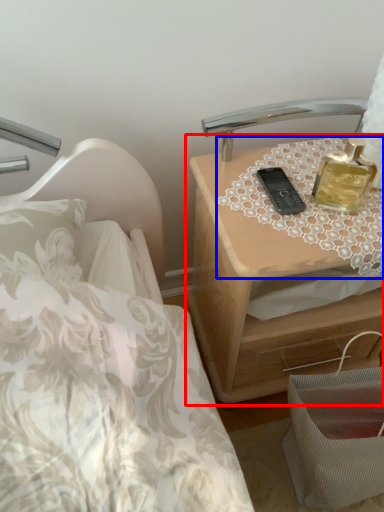
Question: Which object appears farthest to the camera in this image, nightstand (highlighted by a red box) or tablecloth (highlighted by a blue box)?

Choices:
 (A) nightstand
 (B) tablecloth

Answer: (A)